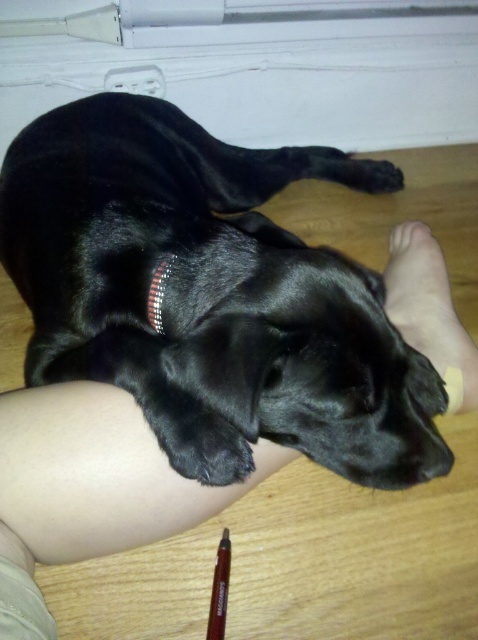
Question: Considering the real-world distances, which object is closest to the brown matte pencil at lower center?

Choices:
 (A) skinny flesh at lower left
 (B) smooth skin foot at lower right

Answer: (A)

Question: Does brown matte pencil at lower center appear under shiny metallic collar at center?

Choices:
 (A) yes
 (B) no

Answer: (A)

Question: Can you confirm if skinny flesh at lower left is bigger than brown matte pencil at lower center?

Choices:
 (A) yes
 (B) no

Answer: (A)

Question: In this image, where is skinny flesh at lower left located relative to smooth skin foot at lower right?

Choices:
 (A) below
 (B) above

Answer: (A)

Question: Which of the following is the closest to the observer?

Choices:
 (A) (162, 273)
 (B) (71, 384)

Answer: (A)

Question: Which of the following is the farthest from the observer?

Choices:
 (A) (161, 292)
 (B) (207, 620)
 (C) (441, 364)

Answer: (C)